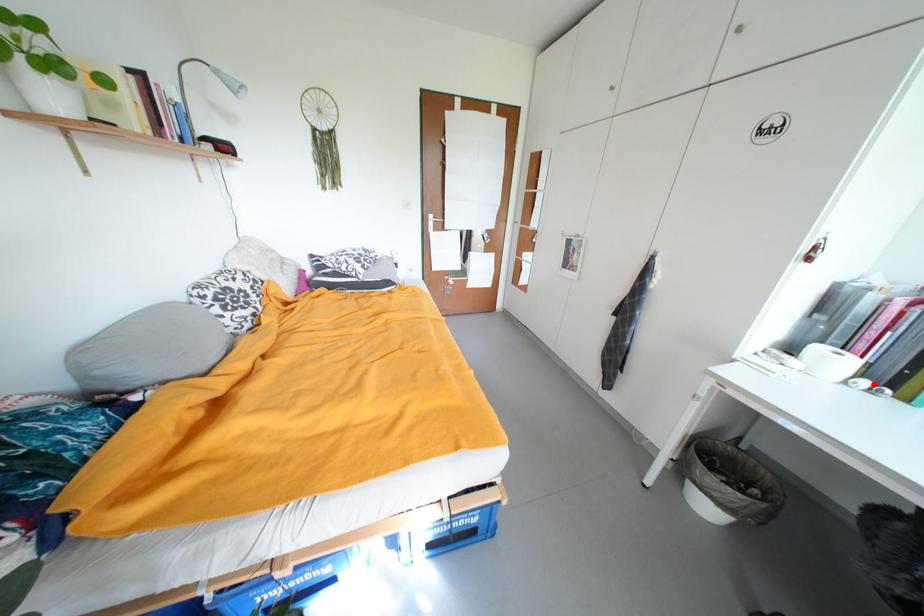
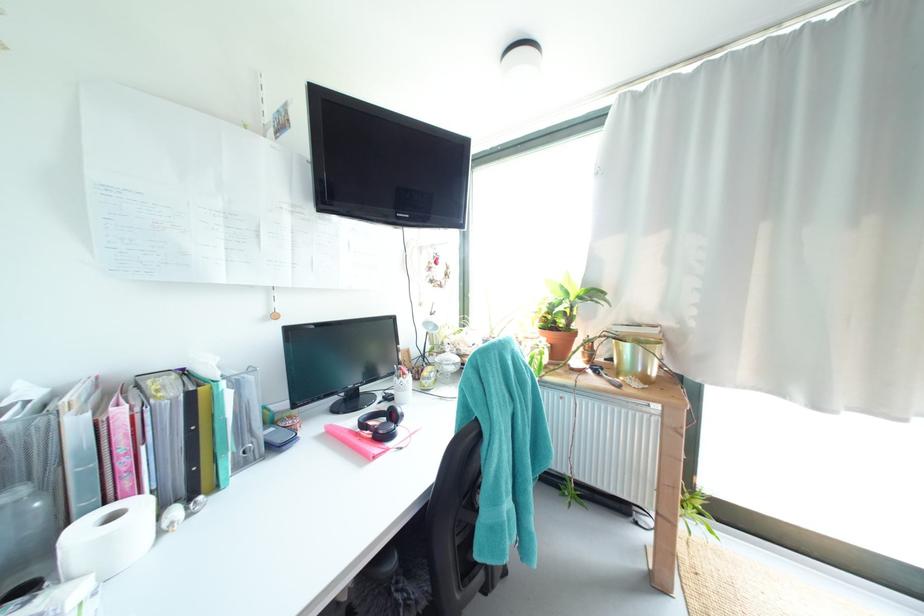
Locate, in the second image, the point that corresponds to the highlighted location in the first image.

(185, 513)